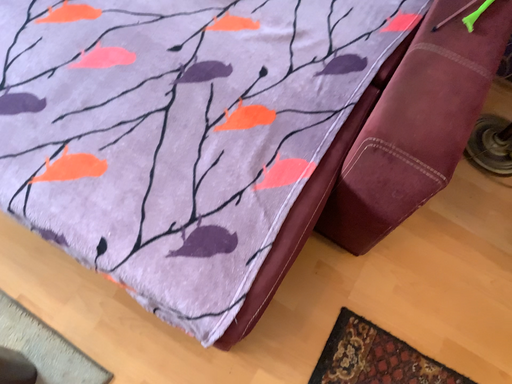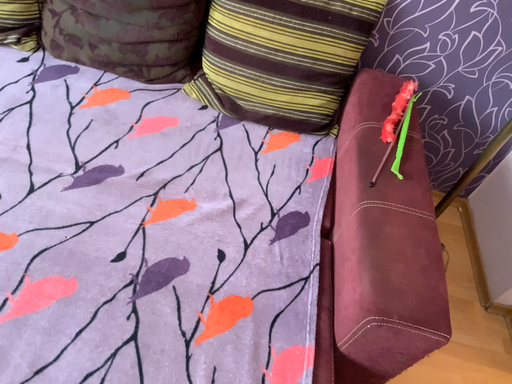
Question: Which way did the camera rotate in the video?

Choices:
 (A) rotated upward
 (B) rotated downward

Answer: (A)